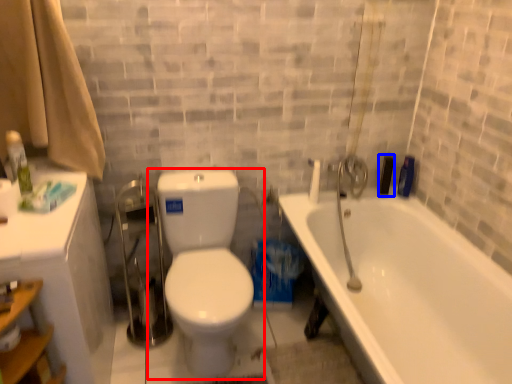
Question: Which object is further to the camera taking this photo, toilet (highlighted by a red box) or toiletry (highlighted by a blue box)?

Choices:
 (A) toilet
 (B) toiletry

Answer: (B)